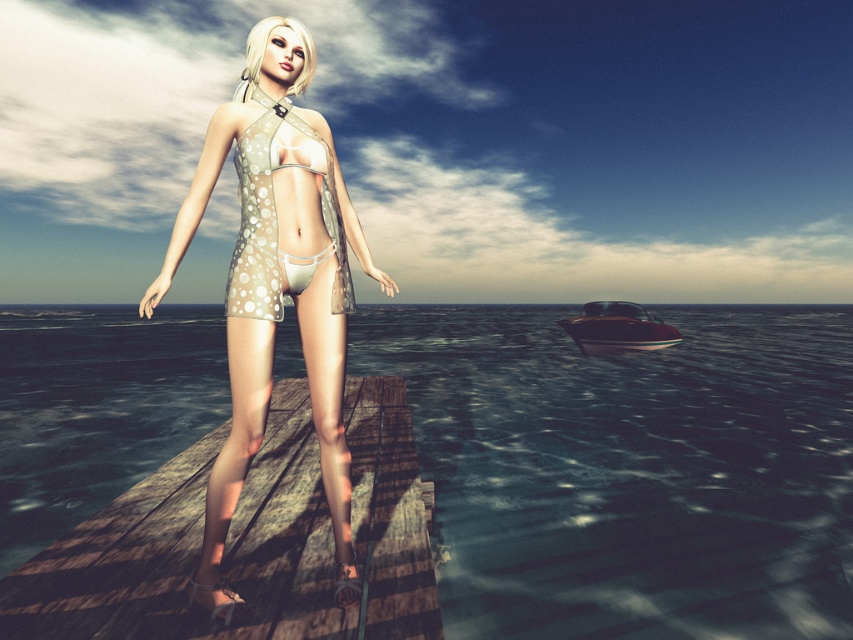
Based on the photo, you are a photographer standing on the wooden pier in the coastal scene. You want to take a photo of the two points marked in the image. Which point, point [640,477] or point [241,184], is closer to your camera lens?

Point [640,477] is closer to the camera lens because it is further to the viewer than point [241,184].

You are a photographer standing on the wooden pier and want to capture a photo of the matte beige swimsuit at center and the translucent blue water at center. If your camera has a depth of field that can focus on objects within a 40 feet range, will both objects be in focus?

The translucent blue water at center is 41.87 feet from matte beige swimsuit at center. Since the distance between them exceeds the camera lens depth of field range of 40 feet, both objects cannot be in focus simultaneously.